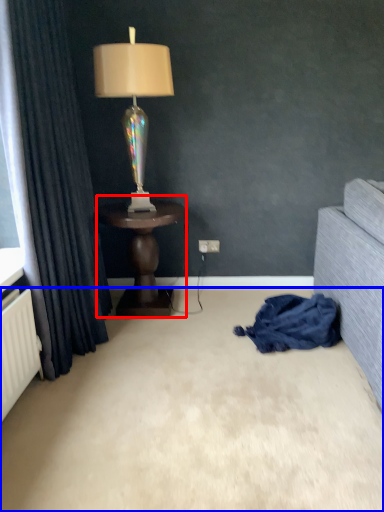
Question: Among these objects, which one is nearest to the camera, table (highlighted by a red box) or plain (highlighted by a blue box)?

Choices:
 (A) table
 (B) plain

Answer: (B)